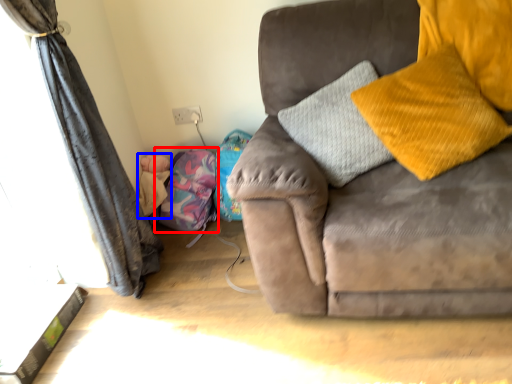
Question: Which object appears closest to the camera in this image, bean bag chair (highlighted by a red box) or baby (highlighted by a blue box)?

Choices:
 (A) bean bag chair
 (B) baby

Answer: (A)